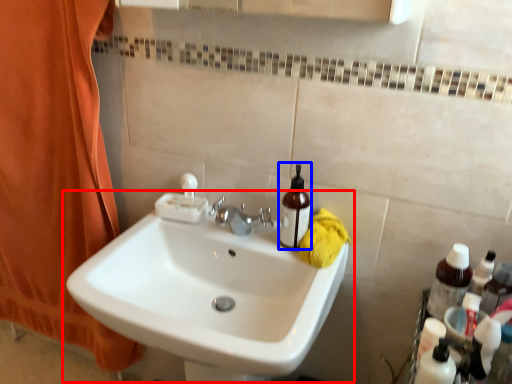
Question: Which of the following is the farthest to the observer, sink (highlighted by a red box) or mouthwash (highlighted by a blue box)?

Choices:
 (A) sink
 (B) mouthwash

Answer: (B)